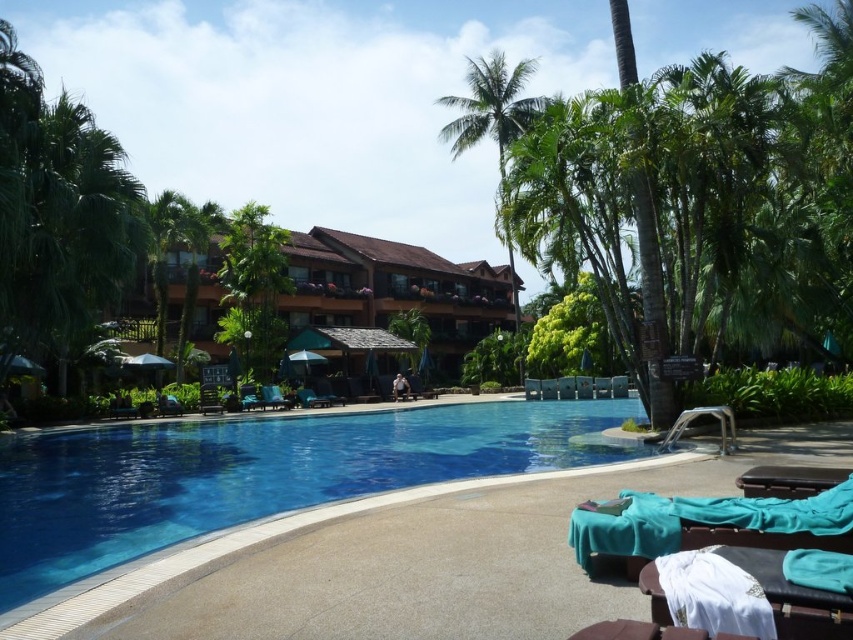
Consider the image. You are standing at the edge of the pool and want to reach the point marked at coordinates point (341, 294). Considering the pool is 40 meters long, can you safely swim to that point without exceeding the pool length?

The point marked at coordinates point (341, 294) is 39.55 meters from the viewer, which is within the 40 meter length of the pool. Yes, you can safely swim to that point without exceeding the pool length.

You are a guest at the resort and want to choose a beach chair that can accommodate your large beach bag. Which chair between the wooden beach chair at center and the metallic silver beach chair at lower right would you recommend?

The wooden beach chair at center has a larger size compared to the metallic silver beach chair at lower right, so it can accommodate your large beach bag better.

You are a guest at the resort and want to take a photo of the brown wooden hotel at center from the matte blue lounge chair at center. Will the entire hotel fit in your camera frame if you stand on the lounge chair?

The brown wooden hotel at center is much taller than the matte blue lounge chair at center, so standing on the lounge chair may not be sufficient to capture the entire hotel in the camera frame due to its height difference.